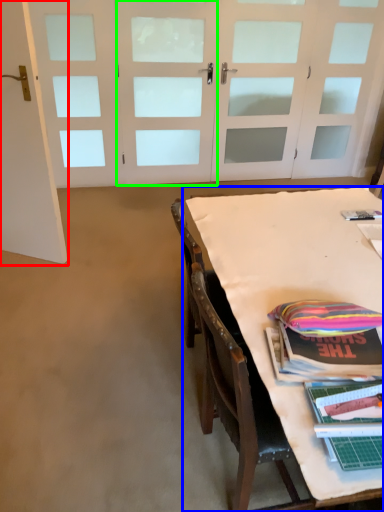
Question: Estimate the real-world distances between objects in this image. Which object is farther from door (highlighted by a red box), table (highlighted by a blue box) or door (highlighted by a green box)?

Choices:
 (A) table
 (B) door

Answer: (B)